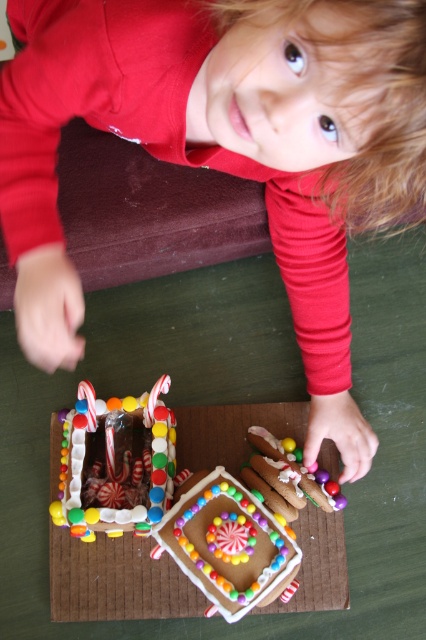
In the scene shown: You are a baker who wants to place both the glossy chocolate cake at center and the glossy icing gingerbread house at center on a rectangular tray. The tray can only hold items that are smaller than 12 inches in width. Based on their sizes, will both items fit on the tray?

The glossy chocolate cake at center is larger in size than the glossy icing gingerbread house at center. Since the chocolate cake is bigger, if it is under 12 inches in width, both can fit. However, if the chocolate cake exceeds 12 inches, it won